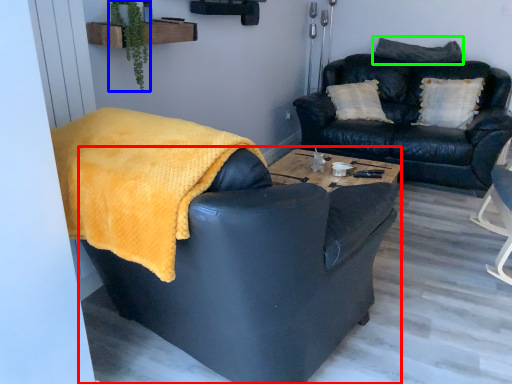
Question: Considering the real-world distances, which object is farthest from chair (highlighted by a red box)? plant (highlighted by a blue box) or pillow (highlighted by a green box)?

Choices:
 (A) plant
 (B) pillow

Answer: (B)